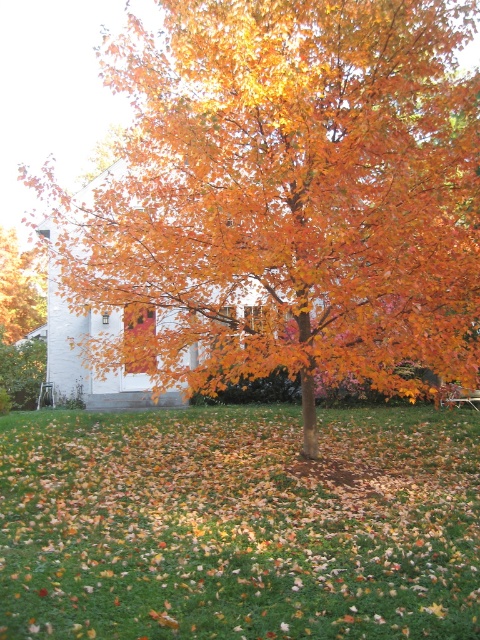
Does green grass at center lie in front of orange matte tree at center?

Yes, it is in front of orange matte tree at center.

Who is lower down, green grass at center or orange matte tree at center?

green grass at center is lower down.

The image size is (480, 640). What do you see at coordinates (239, 525) in the screenshot? I see `green grass at center` at bounding box center [239, 525].

You are a GUI agent. You are given a task and a screenshot of the screen. Output one action in this format:
    pyautogui.click(x=<x>, y=<y>)
    Task: Click on the green grass at center
    
    Given the screenshot: What is the action you would take?
    pyautogui.click(x=239, y=525)

Who is positioned more to the right, golden glossy tree at center or orange matte tree at center?

Positioned to the right is golden glossy tree at center.

Is point (96, 252) positioned behind point (29, 256)?

No.

The width and height of the screenshot is (480, 640). Describe the element at coordinates (286, 196) in the screenshot. I see `golden glossy tree at center` at that location.

Image resolution: width=480 pixels, height=640 pixels. Find the location of `golden glossy tree at center`. golden glossy tree at center is located at coordinates (286, 196).

In the scene shown: Which is more to the left, golden glossy tree at center or green grass at center?

Positioned to the left is green grass at center.

Does golden glossy tree at center have a greater width compared to green grass at center?

No.

Image resolution: width=480 pixels, height=640 pixels. What do you see at coordinates (286, 196) in the screenshot?
I see `golden glossy tree at center` at bounding box center [286, 196].

Where is `golden glossy tree at center`? The width and height of the screenshot is (480, 640). golden glossy tree at center is located at coordinates 286,196.